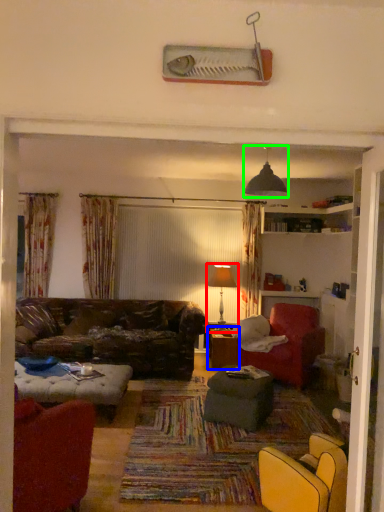
Question: Which object is the closest to the table lamp (highlighted by a red box)? Choose among these: table (highlighted by a blue box) or light fixture (highlighted by a green box).

Choices:
 (A) table
 (B) light fixture

Answer: (A)